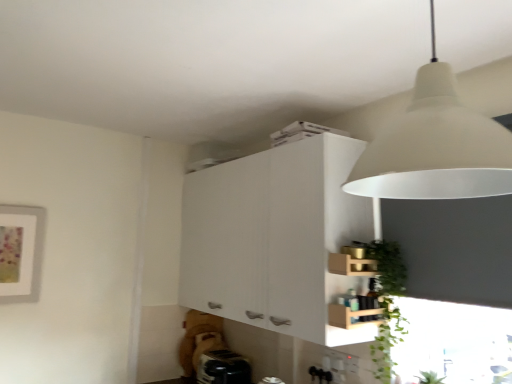
This screenshot has width=512, height=384. Describe the element at coordinates (223, 368) in the screenshot. I see `black plastic toaster at lower center` at that location.

What do you see at coordinates (275, 238) in the screenshot?
I see `white matte cabinet at upper center` at bounding box center [275, 238].

Locate an element on the screen. Image resolution: width=512 pixels, height=384 pixels. wooden crate at lower right is located at coordinates (351, 265).

Describe the element at coordinates (351, 265) in the screenshot. Image resolution: width=512 pixels, height=384 pixels. I see `wooden crate at lower right` at that location.

Measure the distance between white matte lampshade at upper right and camera.

The depth of white matte lampshade at upper right is 26.65 inches.

Locate an element on the screen. black plastic toaster at lower center is located at coordinates (223, 368).

Consider the image. Visually, is white matte lampshade at upper right positioned to the left or to the right of black plastic toaster at lower center?

Based on their positions, white matte lampshade at upper right is located to the right of black plastic toaster at lower center.

Is white matte lampshade at upper right completely or partially outside of black plastic toaster at lower center?

That's correct, white matte lampshade at upper right is outside of black plastic toaster at lower center.

Is white matte lampshade at upper right far away from black plastic toaster at lower center?

That's right, there is a large distance between white matte lampshade at upper right and black plastic toaster at lower center.

Is black plastic toaster at lower center at the back of white matte lampshade at upper right?

white matte lampshade at upper right does not have its back to black plastic toaster at lower center.

From a real-world perspective, which is physically below, white matte lampshade at upper right or wooden crate at lower right?

From a 3D spatial view, wooden crate at lower right is below.

Is point (398, 126) positioned in front of point (348, 269)?

Yes, point (398, 126) is in front of point (348, 269).

Find the location of a particular element. shelf located on the right of white matte lampshade at upper right is located at coordinates (351, 265).

Is white matte lampshade at upper right located outside wooden crate at lower right?

white matte lampshade at upper right is positioned outside wooden crate at lower right.

Considering the relative sizes of wooden crate at lower right and green leafy plant at lower right in the image provided, is wooden crate at lower right taller than green leafy plant at lower right?

In fact, wooden crate at lower right may be shorter than green leafy plant at lower right.

Is the position of wooden crate at lower right more distant than that of green leafy plant at lower right?

Yes, wooden crate at lower right is behind green leafy plant at lower right.

From the image's perspective, is wooden crate at lower right located beneath green leafy plant at lower right?

No, from the image's perspective, wooden crate at lower right is not beneath green leafy plant at lower right.

In the scene shown: Is wooden crate at lower right beside green leafy plant at lower right?

No, wooden crate at lower right is not next to green leafy plant at lower right.

Considering the positions of objects green leafy plant at lower right and white matte cabinet at upper center in the image provided, who is in front, green leafy plant at lower right or white matte cabinet at upper center?

green leafy plant at lower right is closer to the camera.

Is green leafy plant at lower right in contact with white matte cabinet at upper center?

There is a gap between green leafy plant at lower right and white matte cabinet at upper center.

Does green leafy plant at lower right have a lesser height compared to white matte cabinet at upper center?

Yes.

From the image's perspective, between green leafy plant at lower right and white matte cabinet at upper center, who is located below?

green leafy plant at lower right.

From the image's perspective, which is below, green leafy plant at lower right or white matte lampshade at upper right?

green leafy plant at lower right is shown below in the image.

Is green leafy plant at lower right shorter than white matte lampshade at upper right?

Correct, green leafy plant at lower right is not as tall as white matte lampshade at upper right.

From a real-world perspective, is green leafy plant at lower right on top of white matte lampshade at upper right?

No, from a real-world perspective, green leafy plant at lower right is not above white matte lampshade at upper right.

Considering the relative sizes of green leafy plant at lower right and white matte lampshade at upper right in the image provided, is green leafy plant at lower right smaller than white matte lampshade at upper right?

Correct, green leafy plant at lower right occupies less space than white matte lampshade at upper right.

From a real-world perspective, is white matte lampshade at upper right on white matte cabinet at upper center?

Yes, from a real-world perspective, white matte lampshade at upper right is on top of white matte cabinet at upper center.

From the image's perspective, which is below, white matte lampshade at upper right or white matte cabinet at upper center?

white matte cabinet at upper center appears lower in the image.

At what (x,y) coordinates should I click in order to perform the action: click on lamp in front of the white matte cabinet at upper center. Please return your answer as a coordinate pair (x, y). The width and height of the screenshot is (512, 384). Looking at the image, I should click on (435, 147).

Is white matte lampshade at upper right turned away from white matte cabinet at upper center?

That's not correct — white matte lampshade at upper right is not looking away from white matte cabinet at upper center.

In terms of height, does white matte cabinet at upper center look taller or shorter compared to green leafy plant at lower right?

Considering their sizes, white matte cabinet at upper center has more height than green leafy plant at lower right.

Looking at this image, from a real-world perspective, which object stands above the other?

white matte cabinet at upper center, from a real-world perspective.

Which of these two, white matte cabinet at upper center or green leafy plant at lower right, is bigger?

With larger size is white matte cabinet at upper center.

Consider the image. From the image's perspective, is white matte cabinet at upper center beneath green leafy plant at lower right?

No.

Image resolution: width=512 pixels, height=384 pixels. In order to click on lamp located in front of the black plastic toaster at lower center in this screenshot , I will do `click(435, 147)`.

I want to click on shelf located behind the white matte lampshade at upper right, so click(351, 265).

Based on their spatial positions, is green leafy plant at lower right or black plastic toaster at lower center further from wooden crate at lower right?

black plastic toaster at lower center lies further to wooden crate at lower right than the other object.

Looking at the image, which one is located closer to white matte cabinet at upper center, white matte lampshade at upper right or wooden crate at lower right?

Among the two, wooden crate at lower right is located nearer to white matte cabinet at upper center.

Which object lies nearer to the anchor point green leafy plant at lower right, white matte lampshade at upper right or wooden crate at lower right?

wooden crate at lower right.

Considering their positions, is white matte cabinet at upper center positioned further to wooden crate at lower right than black plastic toaster at lower center?

black plastic toaster at lower center lies further to wooden crate at lower right than the other object.

Estimate the real-world distances between objects in this image. Which object is closer to green leafy plant at lower right, white matte lampshade at upper right or black plastic toaster at lower center?

Among the two, white matte lampshade at upper right is located nearer to green leafy plant at lower right.

When comparing their distances from green leafy plant at lower right, does white matte cabinet at upper center or white matte lampshade at upper right seem closer?

Based on the image, white matte cabinet at upper center appears to be nearer to green leafy plant at lower right.

From the image, which object appears to be farther from white matte lampshade at upper right, green leafy plant at lower right or wooden crate at lower right?

Among the two, green leafy plant at lower right is located further to white matte lampshade at upper right.

Looking at the image, which one is located closer to white matte cabinet at upper center, green leafy plant at lower right or white matte lampshade at upper right?

green leafy plant at lower right.

Identify the location of plant positioned between white matte lampshade at upper right and black plastic toaster at lower center from near to far. This screenshot has width=512, height=384. (387, 304).

Locate an element on the screen. The height and width of the screenshot is (384, 512). shelf between white matte cabinet at upper center and black plastic toaster at lower center vertically is located at coordinates (351, 265).

Identify the location of shelf positioned between white matte lampshade at upper right and white matte cabinet at upper center from near to far. (351, 265).

Identify the location of plant located between white matte lampshade at upper right and white matte cabinet at upper center in the depth direction. The width and height of the screenshot is (512, 384). (387, 304).